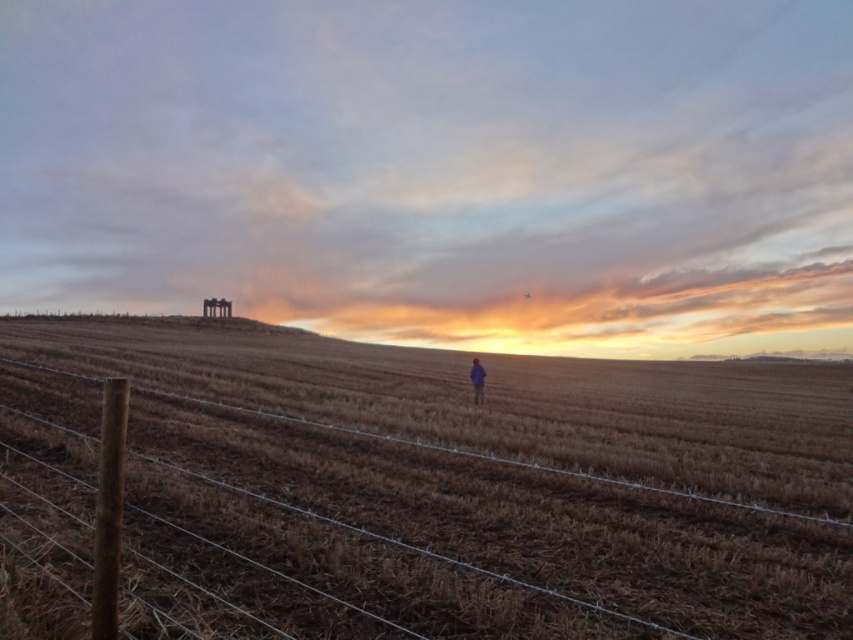
You are a photographer planning to take a landscape photo of the scene described. You want to ensure the brown grass at center and the blue fabric person at center are both clearly visible. Given their height difference, which object might appear larger in the photo and why?

The brown grass at center appears larger in the photo because it is much taller than the blue fabric person at center, making it more prominent in the frame.

You are a photographer standing at the edge of the field with a camera. You want to take a photo that includes both the brown grass at center and the blue fabric person at center. Given that your camera has a maximum focus range of 14 meters, will both subjects be in focus?

The brown grass at center and blue fabric person at center are 13.98 meters apart. Since the distance between them is within the camera maximum focus range of 14 meters, both subjects will be in focus.

You are a photographer trying to capture the scene. You notice the brown grass at center and the blue fabric person at center. Which object is positioned to the right side of the other?

The brown grass at center is to the right of the blue fabric person at center.